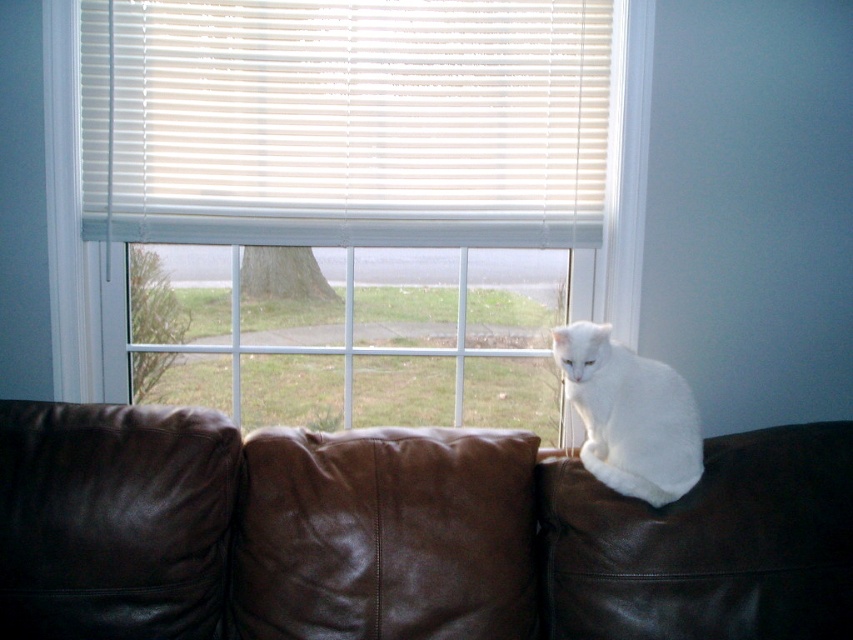
You are a delivery robot that needs to place a small package between the brown leather couch at upper center and the white fluffy cat at upper right. Can you fit the package there if it measures 20 centimeters in length?

The distance between the brown leather couch at upper center and the white fluffy cat at upper right is 22.38 centimeters. Since the package is 20 centimeters long, it can fit in the space between them.

You are standing in the room and want to reach the point marked at coordinates (358, 596). Can you estimate how far you need to walk to get there?

The point marked at coordinates (358, 596) is 1.42 meters away from you, so you need to walk approximately 1.42 meters to reach it.

Consider the image. You are a delivery person carrying a 1.5 meter long package. You need to place it between the brown leather couch at upper center and the window. Is there enough space?

The distance between the brown leather couch at upper center and the window is 1.39 meters. Since the package is 1.5 meters long, it is slightly longer than the available space. Therefore, the package cannot be placed between them without overlapping.